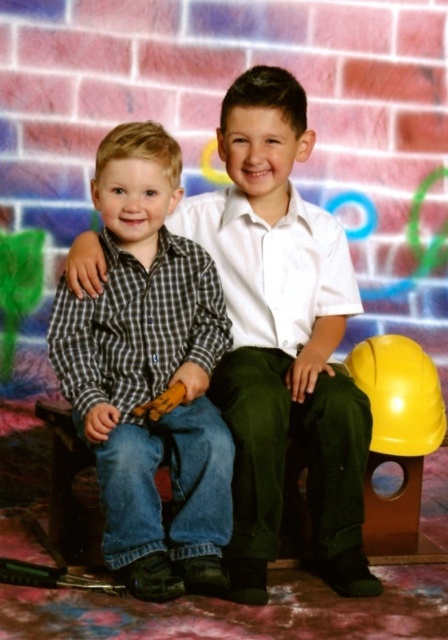
Question: Does checkered fabric shirt at center appear over checkered fabric shirt at left?

Choices:
 (A) yes
 (B) no

Answer: (A)

Question: Can you confirm if checkered fabric shirt at center is positioned to the left of checkered fabric shirt at left?

Choices:
 (A) yes
 (B) no

Answer: (B)

Question: Which of the following is the farthest from the observer?

Choices:
 (A) (136, 432)
 (B) (94, 280)

Answer: (B)

Question: Does checkered fabric shirt at center lie behind checkered fabric shirt at left?

Choices:
 (A) no
 (B) yes

Answer: (B)

Question: Which point is closer to the camera?

Choices:
 (A) checkered fabric shirt at left
 (B) checkered fabric shirt at center

Answer: (A)